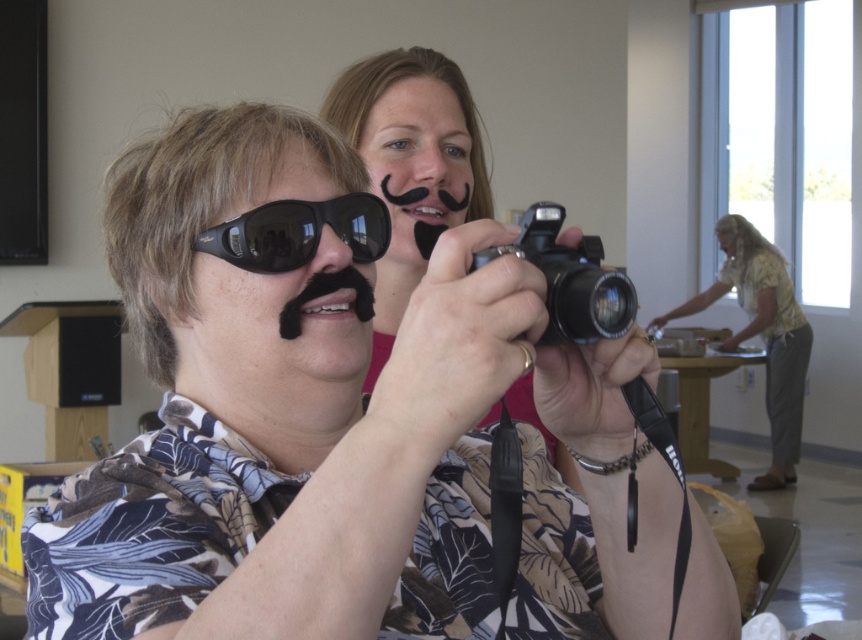
Looking at this image, you are a photographer standing at the edge of the room. You want to take a clear photo of the smooth skin face at center without the black reflective sunglasses at center causing glare. Given that the sunglasses are 6.59 meters away from the face, can you position yourself far enough to avoid glare?

The black reflective sunglasses at center is 6.59 meters away from smooth skin face at center. Since the sunglasses are positioned away from the face, their reflection might not directly affect the photo. However, the exact positioning and angle would determine glare. To minimize glare, move slightly to the side or adjust the camera angle so the light source isn

You are standing in the room and want to take a photo using the black matte camera at center. Where should you position yourself to access it?

The black matte camera at center is located at the point with coordinates 0.255 on the x axis and 0.478 on the y axis, so you should position yourself at that coordinate to access it.